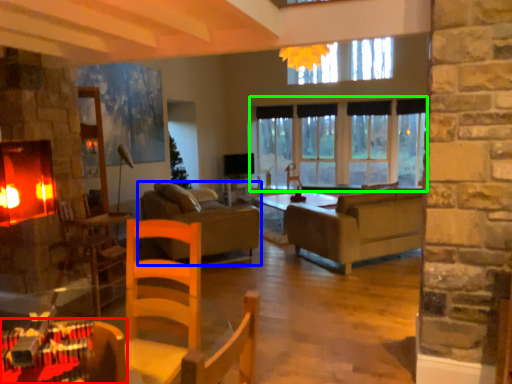
Question: Based on their relative distances, which object is farther from table (highlighted by a red box)? Choose from studio couch (highlighted by a blue box) and window (highlighted by a green box).

Choices:
 (A) studio couch
 (B) window

Answer: (B)